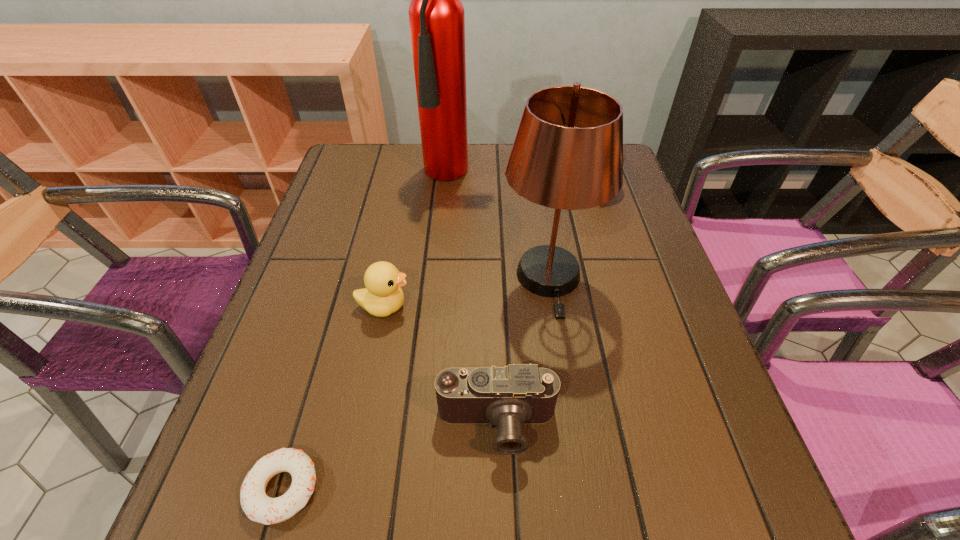
I want to click on the tallest object, so click(x=436, y=14).

Where is `lampshade`? The width and height of the screenshot is (960, 540). lampshade is located at coordinates (567, 154).

What are the coordinates of `the third tallest object` in the screenshot? It's located at (623, 150).

Image resolution: width=960 pixels, height=540 pixels. In order to click on the rightmost object in this screenshot , I will do `click(623, 150)`.

At what (x,y) coordinates should I click in order to perform the action: click on duck. Please return your answer as a coordinate pair (x, y). This screenshot has height=540, width=960. Looking at the image, I should click on (383, 295).

What are the coordinates of `camera` in the screenshot? It's located at (510, 396).

This screenshot has width=960, height=540. I want to click on the shortest object, so click(258, 507).

The width and height of the screenshot is (960, 540). I want to click on free spot located at the nozzle of the fire extinguisher, so click(x=454, y=267).

Identify the location of vacant space located on the front-facing side of the lampshade. click(x=572, y=434).

Find the location of a particular element. vacant space located 0.100m on the left of the bowl is located at coordinates click(x=549, y=185).